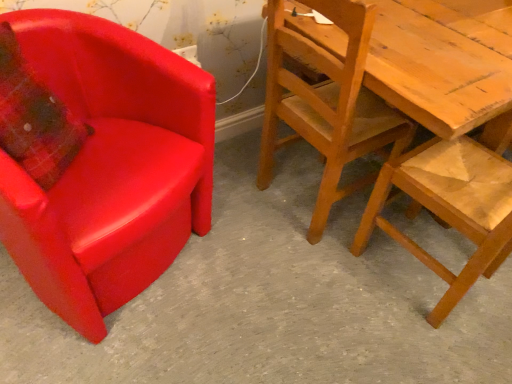
Locate an element on the screen. free spot to the left of wooden textured chair at right, which is the 1th chair from right to left is located at coordinates (327, 284).